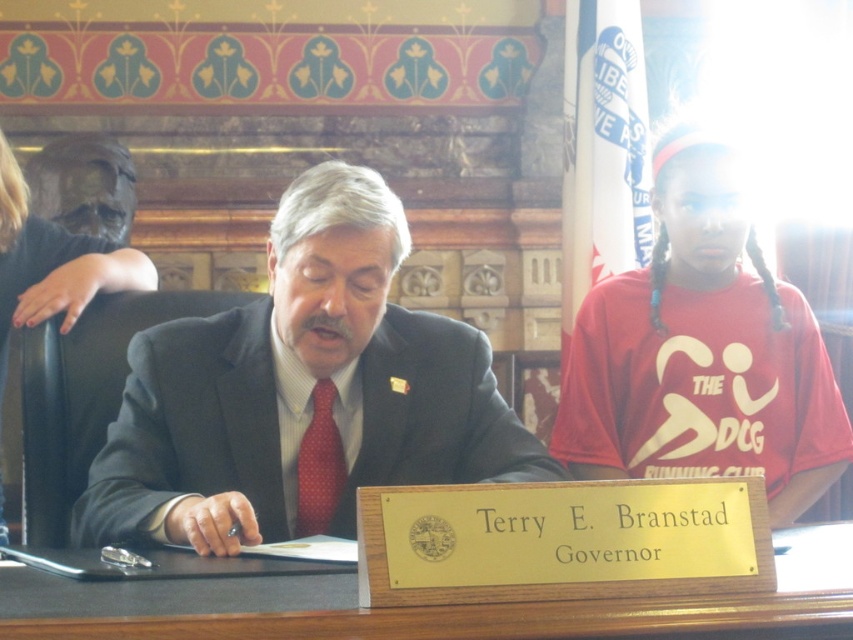
Identify the location of dark gray suit at center. Image resolution: width=853 pixels, height=640 pixels. (300, 388).

Does dark gray suit at center come in front of red dotted tie at center?

Yes, dark gray suit at center is closer to the viewer.

Locate an element on the screen. The width and height of the screenshot is (853, 640). dark gray suit at center is located at coordinates (300, 388).

Is wooden table at center to the left of red dotted tie at center from the viewer's perspective?

Incorrect, wooden table at center is not on the left side of red dotted tie at center.

Consider the image. Can you confirm if wooden table at center is positioned to the right of red dotted tie at center?

Correct, you'll find wooden table at center to the right of red dotted tie at center.

Image resolution: width=853 pixels, height=640 pixels. I want to click on wooden table at center, so click(424, 605).

Looking at this image, is dark gray suit at center below wooden table at center?

No.

Identify the location of dark gray suit at center. click(300, 388).